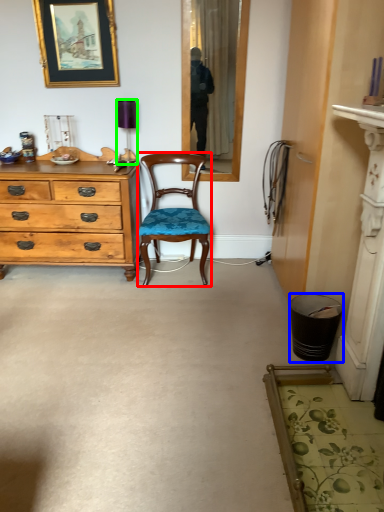
Question: Which object is the closest to the chair (highlighted by a red box)? Choose among these: trash bin/can (highlighted by a blue box) or lamp (highlighted by a green box).

Choices:
 (A) trash bin/can
 (B) lamp

Answer: (B)